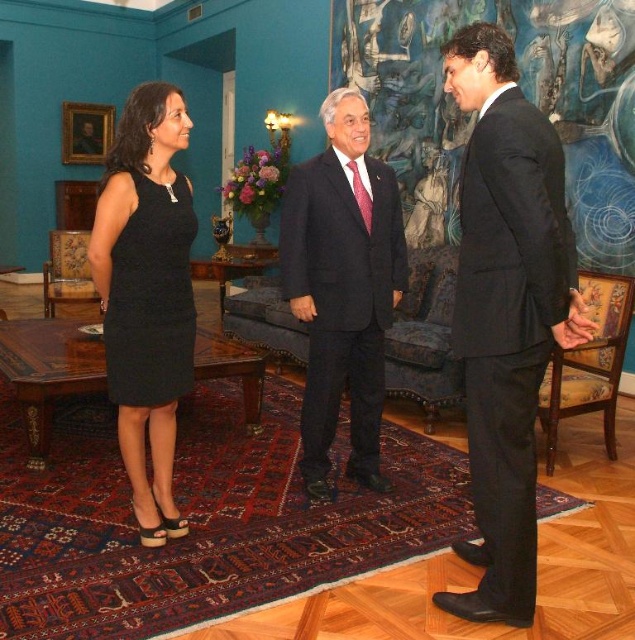
Who is more distant from viewer, (x=540, y=337) or (x=384, y=486)?

The point (x=384, y=486) is more distant.

Between point (448, 605) and point (368, 348), which one is positioned in front?

Point (448, 605) is in front.

This screenshot has width=635, height=640. In order to click on black suit at right in this screenshot , I will do `click(505, 310)`.

Is point (131, 246) positioned before point (312, 444)?

Yes, it is in front of point (312, 444).

Is point (142, 484) closer to camera compared to point (377, 410)?

Yes, it is.

The image size is (635, 640). In order to click on black woven dress at left in this screenshot , I will do `click(145, 292)`.

Is black suit at right further to the viewer compared to black textured dress at left?

No, black suit at right is in front of black textured dress at left.

Find the location of a particular element. The image size is (635, 640). black suit at right is located at coordinates (505, 310).

In order to click on black suit at right in this screenshot , I will do `click(505, 310)`.